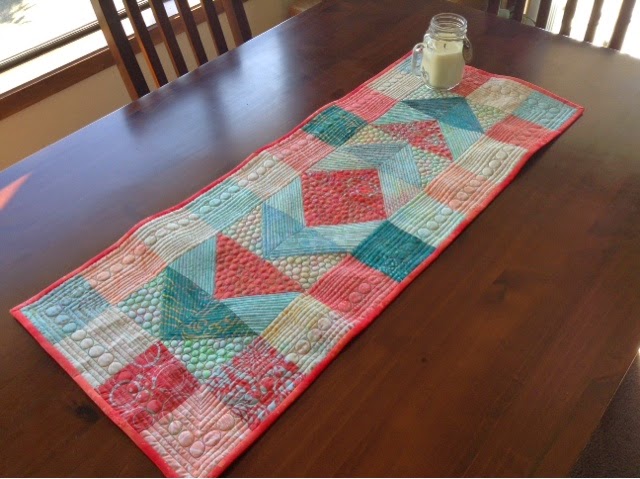
Identify the location of table cloth. The width and height of the screenshot is (640, 479). (x=304, y=279).